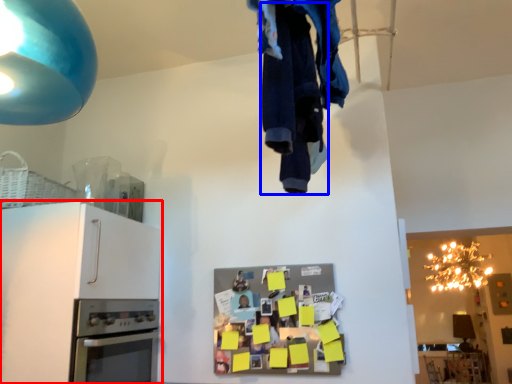
Question: Which of the following is the closest to the observer, cabinetry (highlighted by a red box) or clothing (highlighted by a blue box)?

Choices:
 (A) cabinetry
 (B) clothing

Answer: (B)